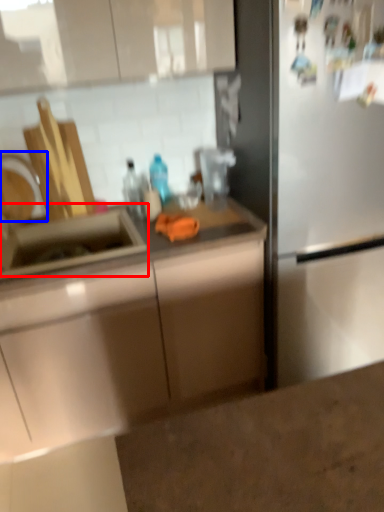
Question: Which object is further to the camera taking this photo, sink (highlighted by a red box) or faucet (highlighted by a blue box)?

Choices:
 (A) sink
 (B) faucet

Answer: (B)